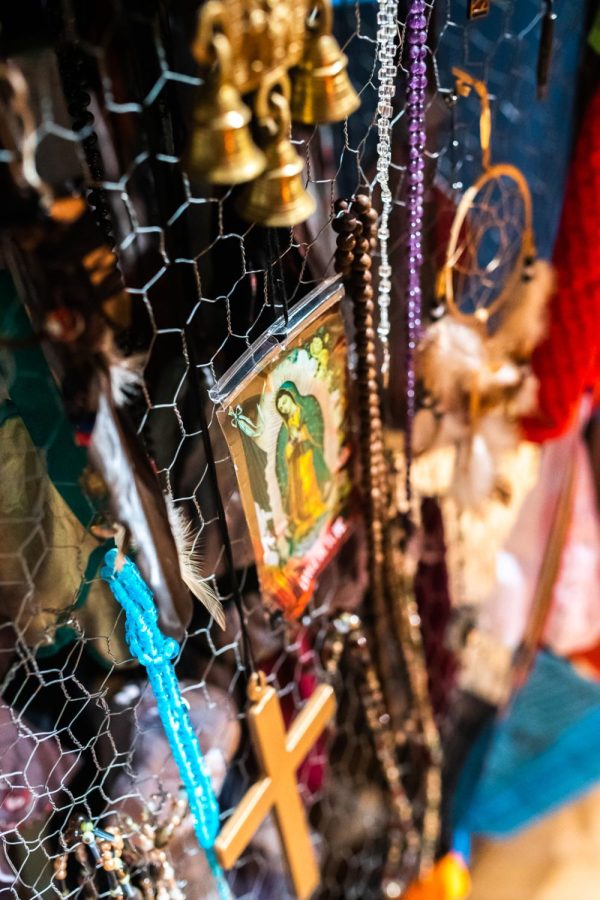
This screenshot has width=600, height=900. What are the coordinates of `wall` in the screenshot? It's located at (506, 112).